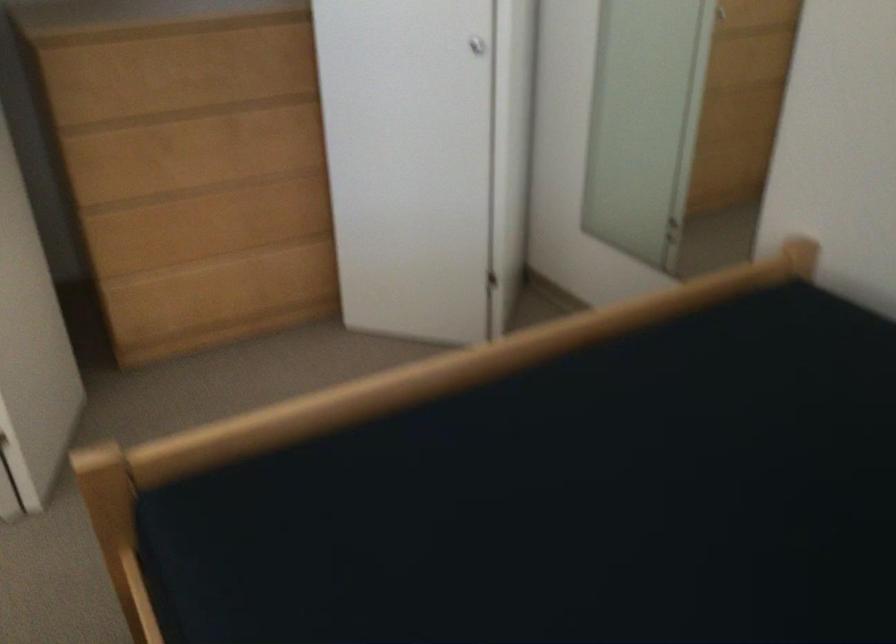
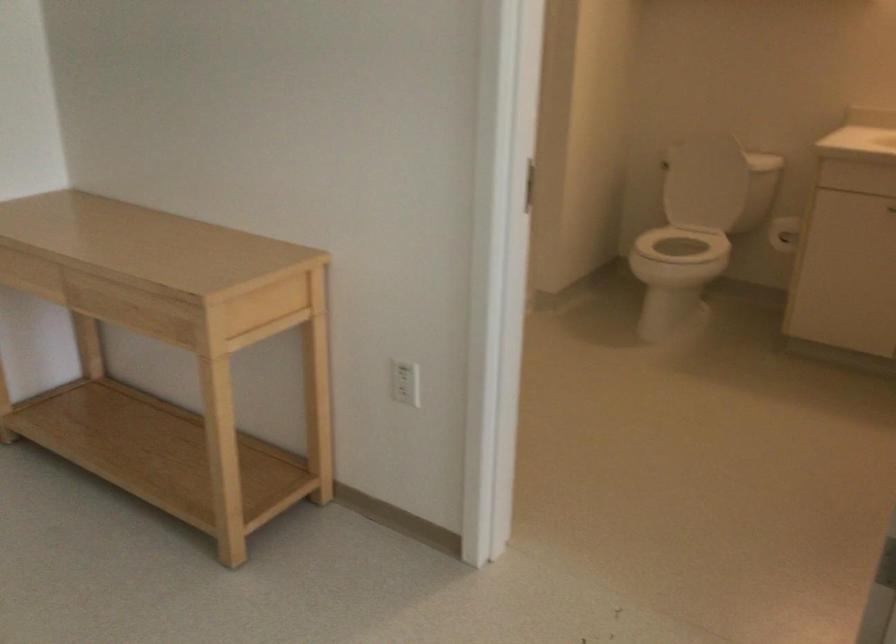
Which direction would the cameraman need to move to produce the second image?

The movement direction of the cameraman is left, forward.